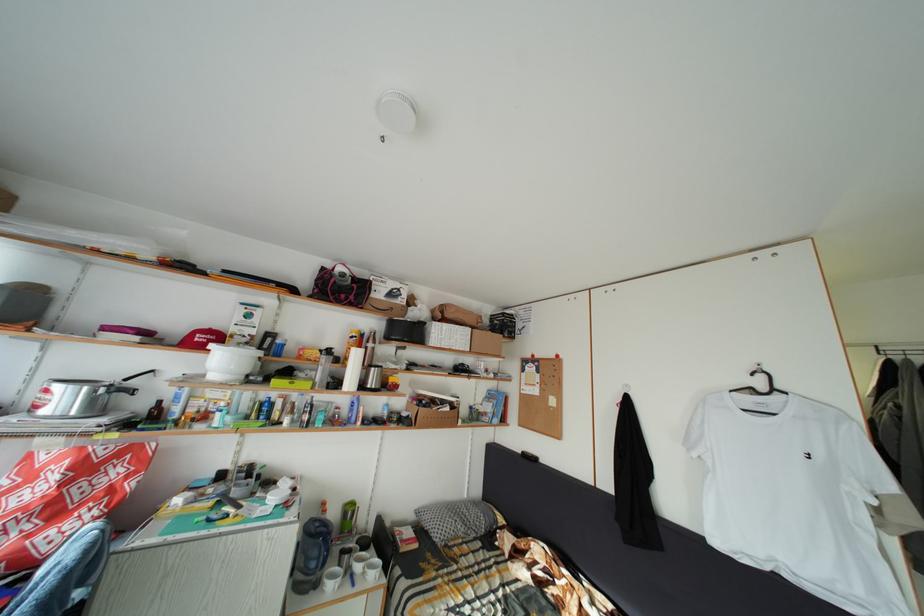
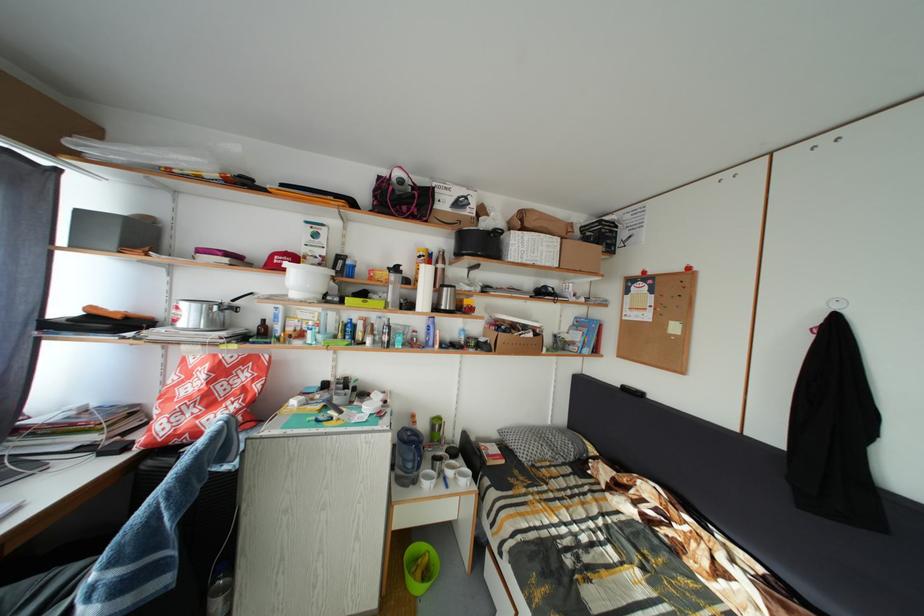
Locate, in the second image, the point that corresponds to point 359,557 in the first image.

(450, 464)